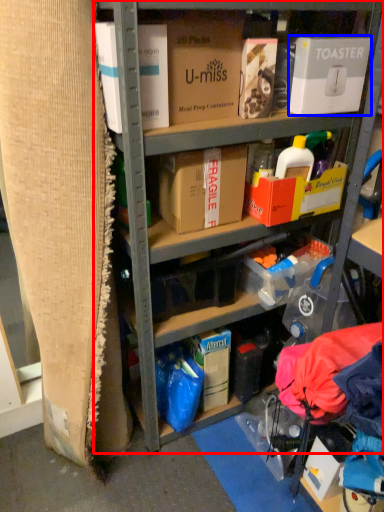
Question: Which point is closer to the camera, shelf (highlighted by a red box) or box (highlighted by a blue box)?

Choices:
 (A) shelf
 (B) box

Answer: (A)